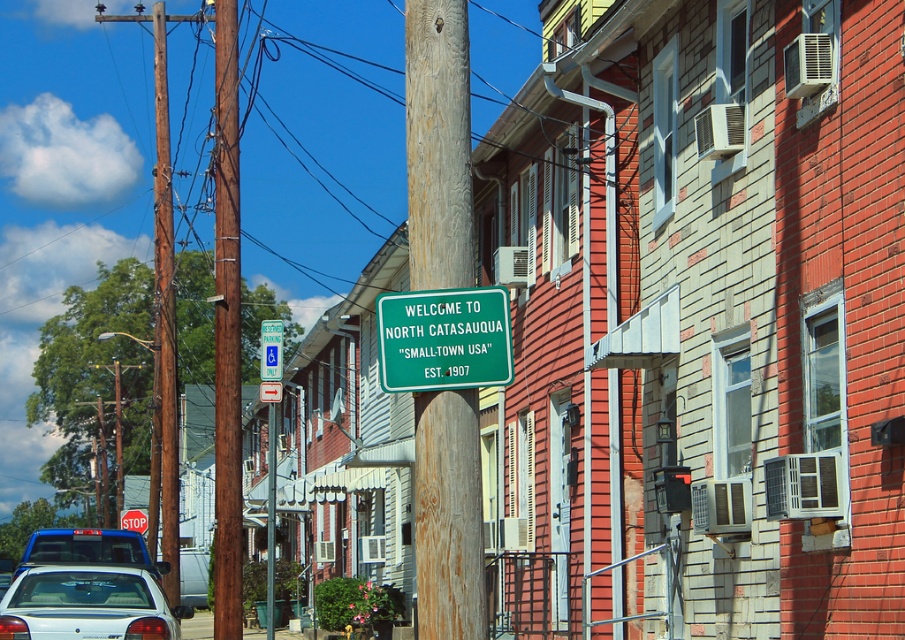
Question: Is wooden post at center behind brown wooden telegraph pole at center?

Choices:
 (A) yes
 (B) no

Answer: (B)

Question: Which point is farther to the camera?

Choices:
 (A) wooden post at center
 (B) green plastic sign at center
 (C) white glossy car at lower left

Answer: (C)

Question: Is white glossy sedan at lower left smaller than white glossy car at lower left?

Choices:
 (A) yes
 (B) no

Answer: (A)

Question: Is brown wooden telegraph pole at center below green plastic sign at center?

Choices:
 (A) no
 (B) yes

Answer: (B)

Question: Which point is closer to the camera?

Choices:
 (A) (429, 385)
 (B) (224, 28)
 (C) (439, 134)

Answer: (A)

Question: Estimate the real-world distances between objects in this image. Which object is farther from the brown wooden telegraph pole at center?

Choices:
 (A) white glossy car at lower left
 (B) white glossy sedan at lower left

Answer: (A)